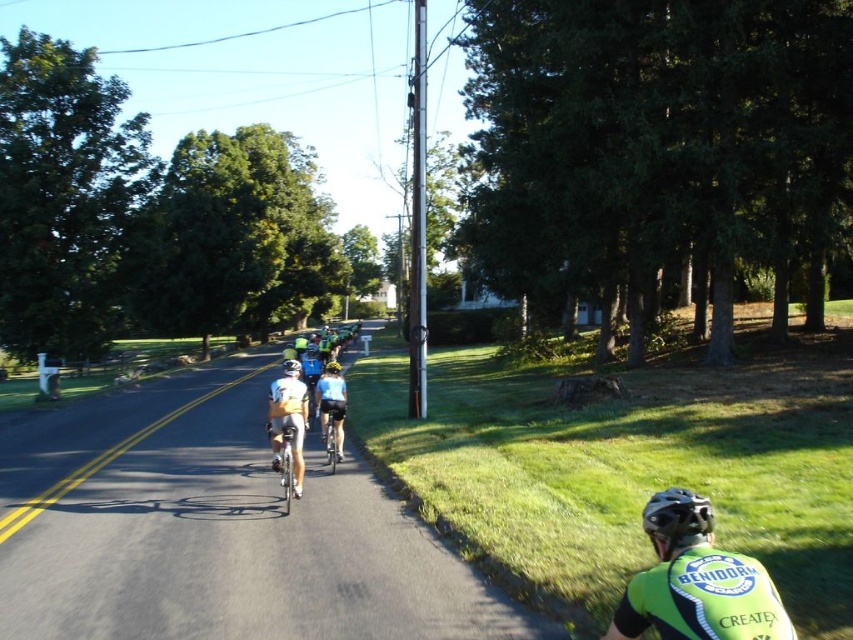
Is yellow jersey at center wider than yellow matte helmet at center?

Incorrect, yellow jersey at center's width does not surpass yellow matte helmet at center's.

Does yellow jersey at center have a lesser height compared to yellow matte helmet at center?

No, yellow jersey at center is not shorter than yellow matte helmet at center.

In order to click on yellow jersey at center in this screenshot , I will do `click(288, 417)`.

You are a GUI agent. You are given a task and a screenshot of the screen. Output one action in this format:
    pyautogui.click(x=<x>, y=<y>)
    Task: Click on the yellow jersey at center
    
    Given the screenshot: What is the action you would take?
    pyautogui.click(x=288, y=417)

Which is in front, point (293, 426) or point (338, 445)?

Point (293, 426) is more forward.

Identify the location of yellow jersey at center. (288, 417).

Does point (334, 438) lie behind point (294, 362)?

Yes, it is behind point (294, 362).

Locate an element on the screen. The height and width of the screenshot is (640, 853). shiny blue bicycle at center is located at coordinates (332, 433).